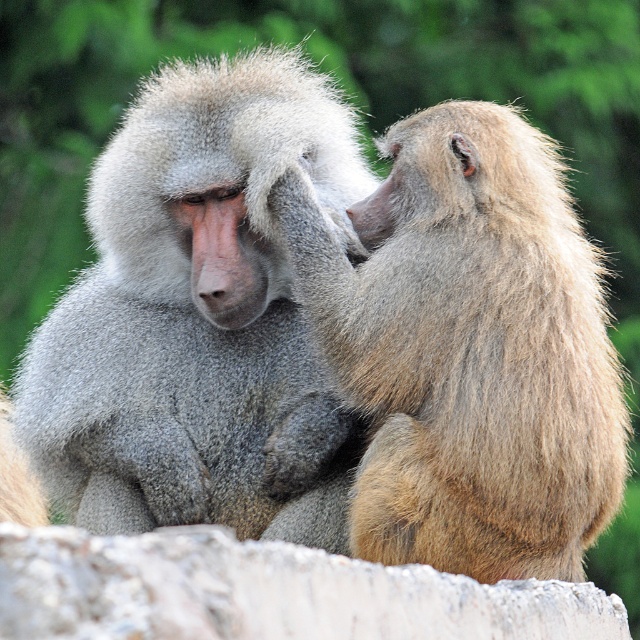
You are a wildlife photographer aiming to capture a closeup shot of the gray fur monkey at left. Your camera has a minimum focusing distance of 10 feet. Based on the scene described, can you successfully take the photo without moving closer than 10 feet?

The distance between the gray fur monkey at left and the camera is 9.56 feet, which is less than the camera minimum focusing distance of 10 feet. Therefore, you cannot take the photo without moving closer than 10 feet.